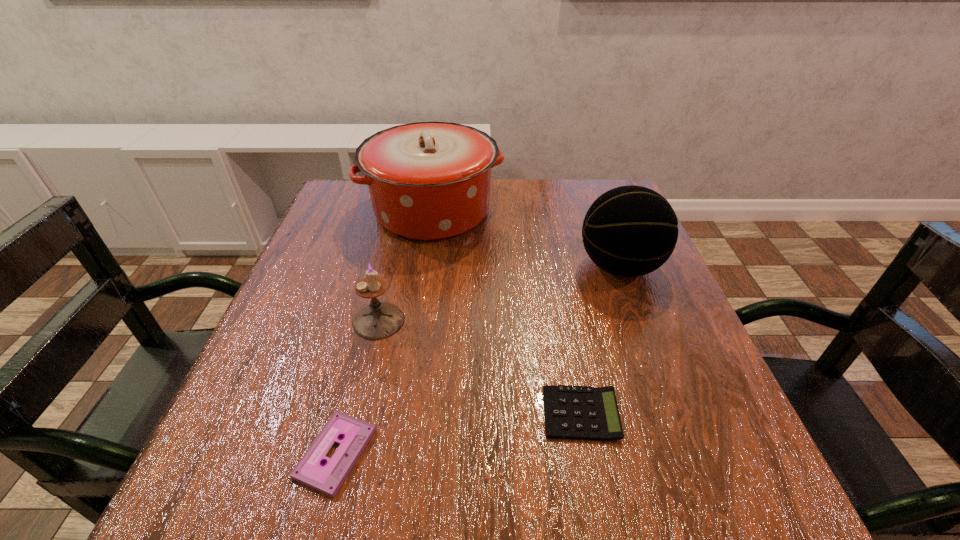
Identify the location of casserole. The width and height of the screenshot is (960, 540). (428, 181).

Identify the location of basketball. The image size is (960, 540). (629, 231).

At what (x,y) coordinates should I click in order to perform the action: click on candle holder. Please return your answer as a coordinate pair (x, y). Looking at the image, I should click on (378, 320).

The image size is (960, 540). I want to click on the third farthest object, so click(x=378, y=320).

The height and width of the screenshot is (540, 960). Identify the location of calculator. (571, 412).

Locate an element on the screen. The image size is (960, 540). videotape is located at coordinates (327, 478).

Image resolution: width=960 pixels, height=540 pixels. What are the coordinates of `free region located on the front of the casserole` in the screenshot? It's located at (420, 289).

Locate an element on the screen. The width and height of the screenshot is (960, 540). free space located on the left of the basketball is located at coordinates (409, 267).

Identify the location of free spot located 0.180m on the back of the third tallest object. The height and width of the screenshot is (540, 960). (396, 248).

The width and height of the screenshot is (960, 540). I want to click on free region located 0.140m on the right of the calculator, so click(x=707, y=414).